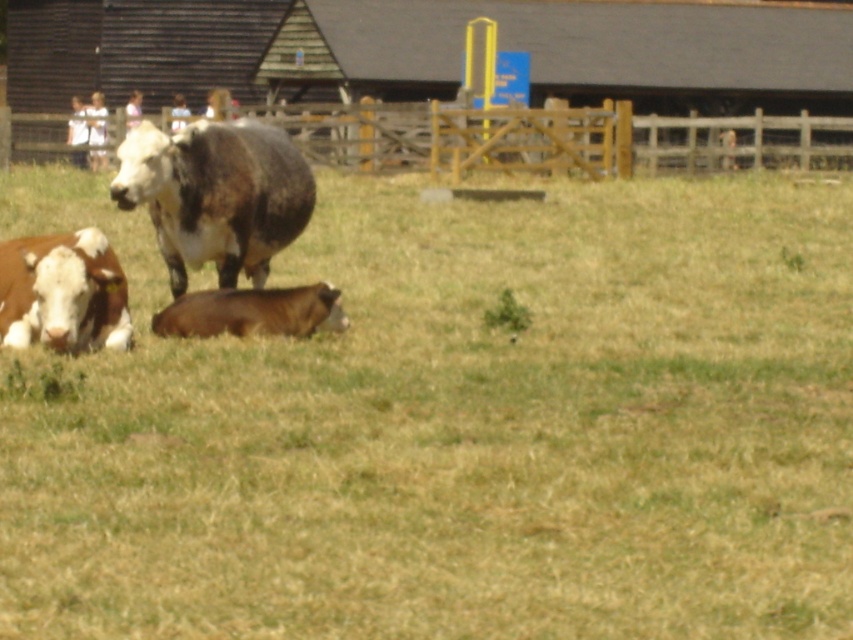
You are a farmer checking the field. You see the brown grassy at lower left and the brown shaggy bull at center. Which area is wider from left to right?

The brown grassy at lower left might be wider than brown shaggy bull at center according to the description.

You are standing in the field and want to walk towards the brown speckled cow at lower left. Which direction should you move relative to the brown grassy at lower left?

To reach the brown speckled cow at lower left, you should move to the left of the brown grassy at lower left since the grassy area is positioned to the right of the cow.